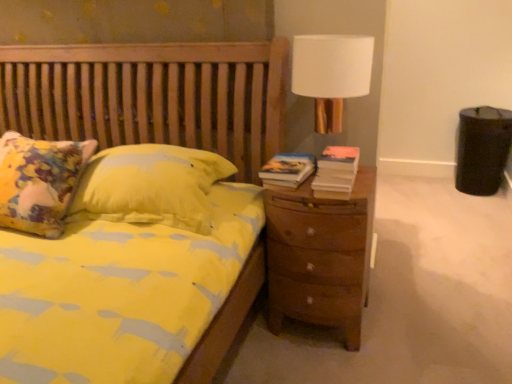
Question: Is hardcover book at right, the first book positioned from the right, completely or partially outside of white fabric lampshade at upper right?

Choices:
 (A) no
 (B) yes

Answer: (A)

Question: Is hardcover book at right, which appears as the second book when viewed from the left, facing towards white fabric lampshade at upper right?

Choices:
 (A) no
 (B) yes

Answer: (A)

Question: Considering the relative sizes of hardcover book at right, which appears as the second book when viewed from the left, and white fabric lampshade at upper right in the image provided, is hardcover book at right, which appears as the second book when viewed from the left, thinner than white fabric lampshade at upper right?

Choices:
 (A) no
 (B) yes

Answer: (B)

Question: From the image's perspective, is hardcover book at right, the first book positioned from the right, located above white fabric lampshade at upper right?

Choices:
 (A) yes
 (B) no

Answer: (B)

Question: Does hardcover book at right, the first book positioned from the right, have a smaller size compared to white fabric lampshade at upper right?

Choices:
 (A) no
 (B) yes

Answer: (B)

Question: Can you confirm if hardcover book at right, which appears as the second book when viewed from the left, is bigger than white fabric lampshade at upper right?

Choices:
 (A) yes
 (B) no

Answer: (B)

Question: From a real-world perspective, is brown wooden nightstand at right physically below hardcover book at right, which appears as the second book when viewed from the left?

Choices:
 (A) yes
 (B) no

Answer: (A)

Question: Would you consider brown wooden nightstand at right to be distant from hardcover book at right, which appears as the second book when viewed from the left?

Choices:
 (A) no
 (B) yes

Answer: (A)

Question: Is brown wooden nightstand at right completely or partially outside of hardcover book at right, which appears as the second book when viewed from the left?

Choices:
 (A) no
 (B) yes

Answer: (B)

Question: Is brown wooden nightstand at right thinner than hardcover book at right, the first book positioned from the right?

Choices:
 (A) no
 (B) yes

Answer: (A)

Question: Would you say brown wooden nightstand at right contains hardcover book at right, the first book positioned from the right?

Choices:
 (A) yes
 (B) no

Answer: (B)

Question: From a real-world perspective, is brown wooden nightstand at right on top of hardcover book at right, the first book positioned from the right?

Choices:
 (A) yes
 (B) no

Answer: (B)

Question: From the image's perspective, is brown wooden nightstand at right under hardcover book at right, the 1th book positioned from the left?

Choices:
 (A) yes
 (B) no

Answer: (A)